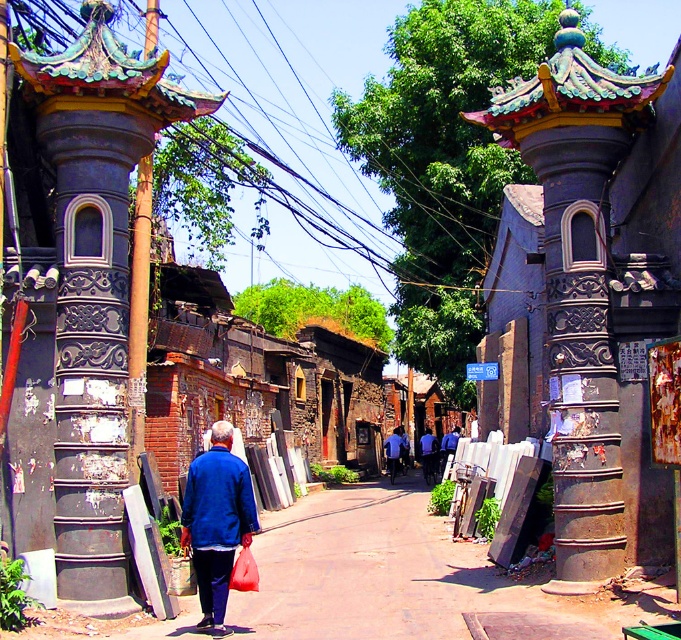
Consider the image. You are a delivery person carrying a package that is 1 meter wide. You need to pass through the alleyway shown in the image. Can you fit through the space between the two objects mentioned? Please consider the width of the brushed metal power line at upper center and the blue matte jacket at center in your answer.

The brushed metal power line at upper center is wider than the blue matte jacket at center. However, since the package is 1 meter wide, and the description only provides a comparison between the two objects without specific measurements, it is unclear if the space between them is sufficient. Therefore, it is uncertain whether the package will fit through the alleyway.

You are a tailor in the alleyway and need to determine which jacket to alter first. Both the blue matte jacket at lower left and the blue fabric jacket at center are in front of you. Which jacket requires more fabric to adjust its size?

The blue fabric jacket at center requires more fabric to adjust its size because it is larger than the blue matte jacket at lower left.

Consider the image. You are a delivery person carrying a package and need to walk through the alleyway. There is a brushed metal power line at upper center and a blue matte jacket at center in your path. Will the power line be an obstacle that you need to duck under while walking?

The brushed metal power line at upper center has a greater height compared to blue matte jacket at center. Since the power line is taller than the jacket, it is likely high enough that you won